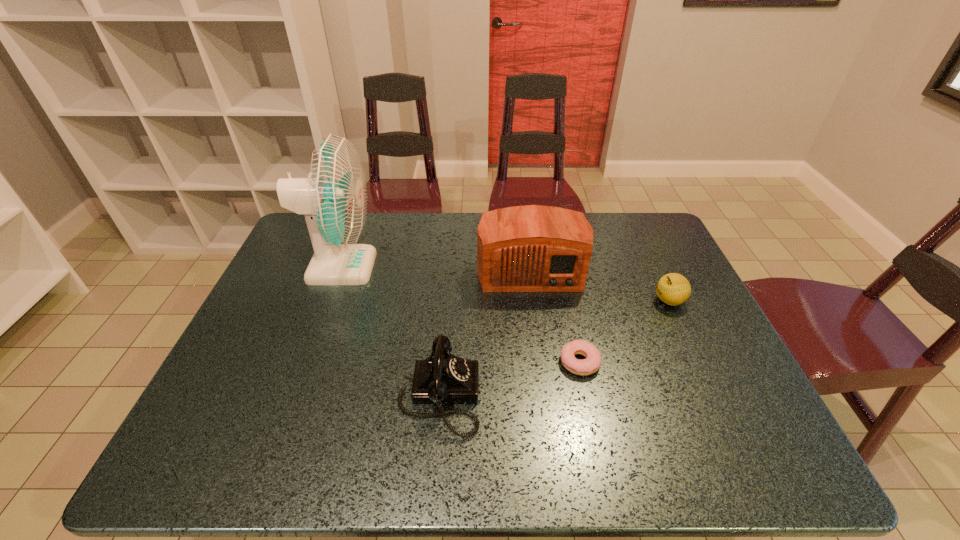
Where is `unoccupied position between the radio receiver and the rightmost object`? unoccupied position between the radio receiver and the rightmost object is located at coordinates (600, 284).

The image size is (960, 540). I want to click on vacant space that's between the leftmost object and the telephone, so click(x=390, y=331).

Identify the location of free spot between the doughnut and the radio receiver. (555, 315).

Identify the location of unoccupied area between the third shortest object and the radio receiver. This screenshot has height=540, width=960. (485, 332).

This screenshot has height=540, width=960. Identify the location of object that stands as the second closest to the third shortest object. (533, 248).

You are a GUI agent. You are given a task and a screenshot of the screen. Output one action in this format:
    pyautogui.click(x=<x>, y=<y>)
    Task: Click on the object that is the fourth nearest to the third shortest object
    The width and height of the screenshot is (960, 540).
    Given the screenshot: What is the action you would take?
    pyautogui.click(x=673, y=289)

You are a GUI agent. You are given a task and a screenshot of the screen. Output one action in this format:
    pyautogui.click(x=<x>, y=<y>)
    Task: Click on the vacant space that satisfies the following two spatial constraints: 1. on the front-facing side of the radio receiver; 2. on the dial of the telephone
    
    Given the screenshot: What is the action you would take?
    pyautogui.click(x=547, y=395)

Identify the location of vacant area in the image that satisfies the following two spatial constraints: 1. on the back side of the shortest object; 2. in front of the fan to face the airflow. Image resolution: width=960 pixels, height=540 pixels. (560, 267).

Where is `vacant space that satisfies the following two spatial constraints: 1. on the front-facing side of the shortest object; 2. on the left side of the second tallest object`? The width and height of the screenshot is (960, 540). vacant space that satisfies the following two spatial constraints: 1. on the front-facing side of the shortest object; 2. on the left side of the second tallest object is located at coordinates (542, 362).